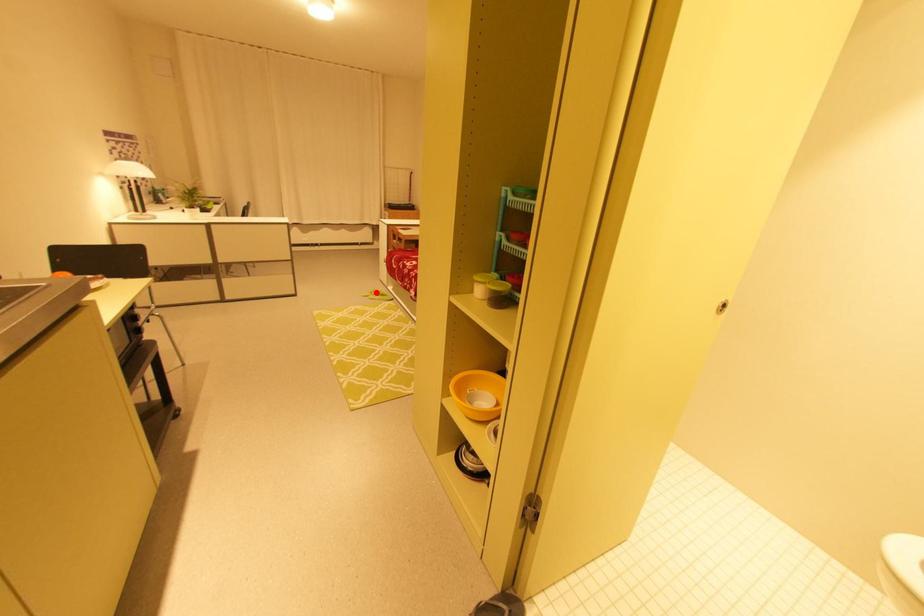
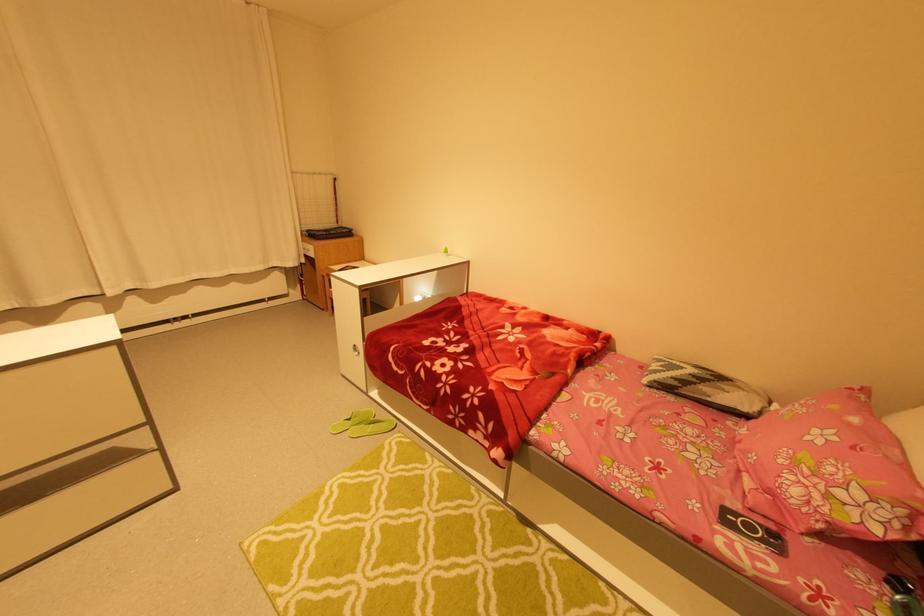
Find the pixel in the second image that matches the highlighted location in the first image.

(354, 419)